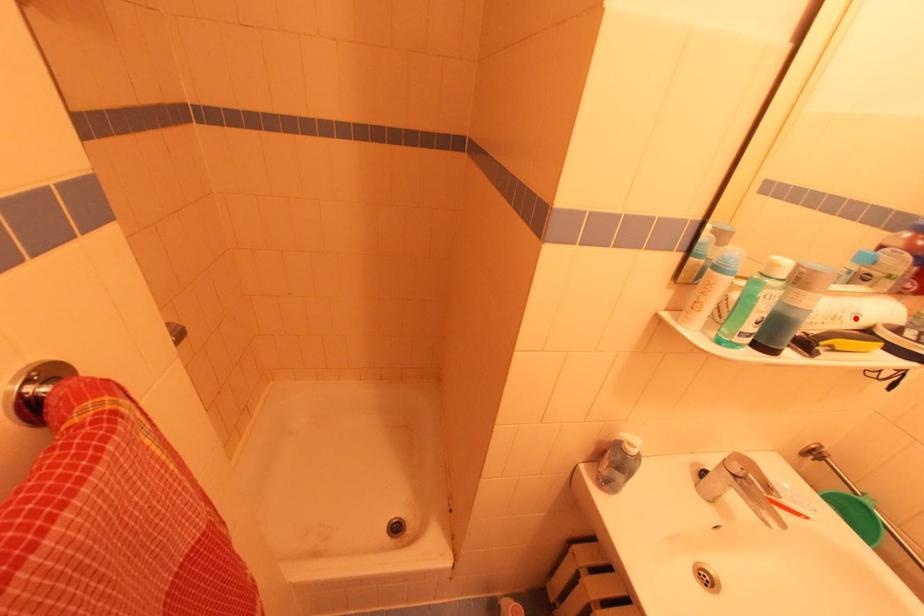
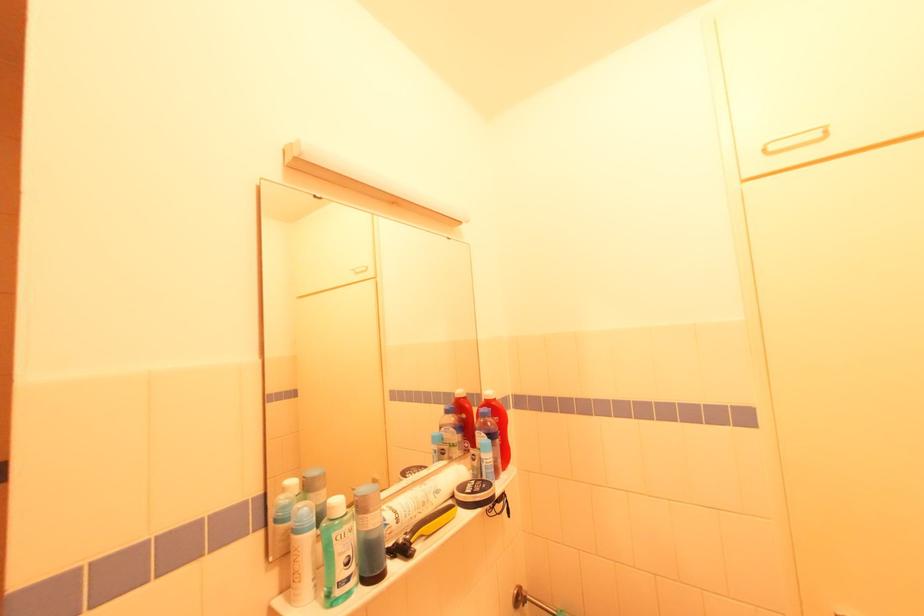
Where in the second image is the point corresponding to the highlighted location from the first image?

(438, 496)